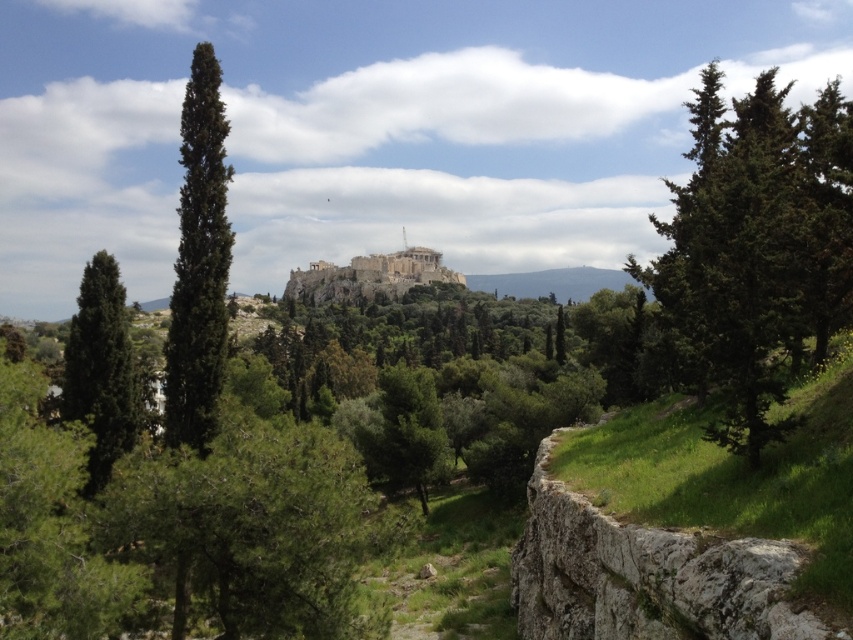
Question: Is green textured tree at left closer to the viewer compared to stone/brick castle at center?

Choices:
 (A) yes
 (B) no

Answer: (A)

Question: Is green textured tree at left closer to the viewer compared to green matte tree at left?

Choices:
 (A) yes
 (B) no

Answer: (B)

Question: Among these points, which one is nearest to the camera?

Choices:
 (A) (97, 356)
 (B) (207, 390)
 (C) (329, 292)
 (D) (840, 214)

Answer: (D)

Question: Which point appears farthest from the camera in this image?

Choices:
 (A) (759, 448)
 (B) (221, 109)

Answer: (B)

Question: Among these points, which one is farthest from the camera?

Choices:
 (A) (207, 332)
 (B) (83, 385)

Answer: (B)

Question: Is green matte tree at left to the right of stone/brick castle at center from the viewer's perspective?

Choices:
 (A) no
 (B) yes

Answer: (B)